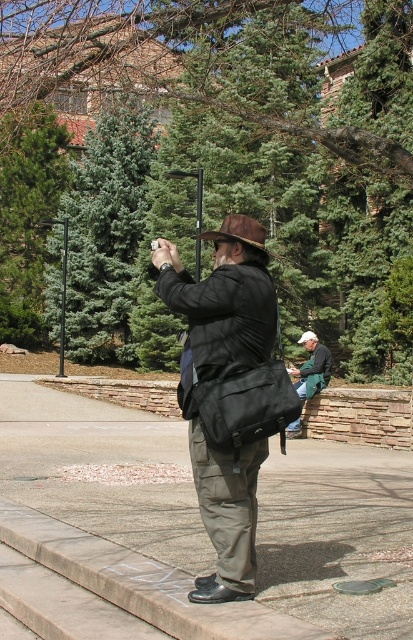
Question: Which point is farther to the camera?

Choices:
 (A) (370, 451)
 (B) (19, 147)

Answer: (B)

Question: Can you confirm if concrete pavement at center is positioned to the right of blue-green foliage at center?

Choices:
 (A) yes
 (B) no

Answer: (A)

Question: Can you confirm if concrete pavement at center is smaller than green pine tree at upper left?

Choices:
 (A) no
 (B) yes

Answer: (B)

Question: In this image, where is green needle-like leaves at center located relative to green fabric jacket at center?

Choices:
 (A) above
 (B) below

Answer: (A)

Question: Which object is closer to the camera taking this photo?

Choices:
 (A) blue-green foliage at center
 (B) concrete pavement at center
 (C) matte black bag at center
 (D) green pine tree at upper left

Answer: (B)

Question: Which point is farther to the camera?

Choices:
 (A) green needle-like leaves at center
 (B) green fabric jacket at center
 (C) concrete pavement at center

Answer: (B)